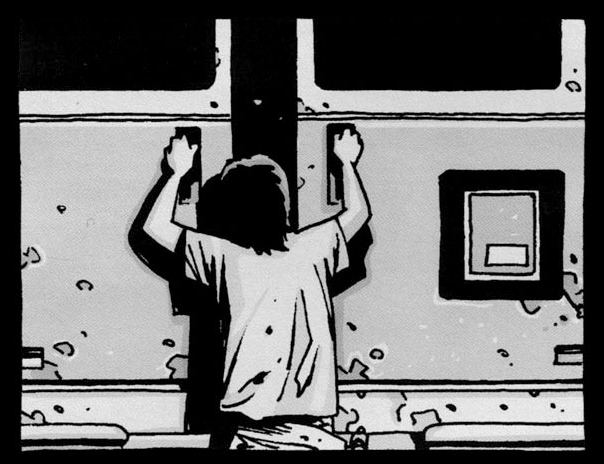
Locate an element on the screen. This screenshot has height=464, width=604. door is located at coordinates (217, 129), (339, 115).